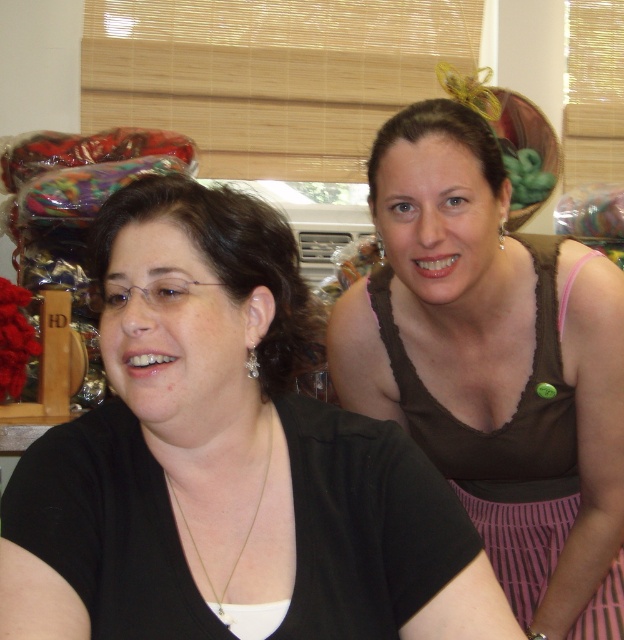
Question: Which point is farther from the camera taking this photo?

Choices:
 (A) [285, 604]
 (B) [295, 406]
 (C) [547, 276]

Answer: (C)

Question: Is matte black shirt at upper right smaller than pink striped fabric dress at upper right?

Choices:
 (A) no
 (B) yes

Answer: (B)

Question: Based on their relative distances, which object is farther from the gold chain necklace at center?

Choices:
 (A) pink striped fabric dress at upper right
 (B) matte black shirt at upper right

Answer: (A)

Question: Can you confirm if matte black shirt at upper right is thinner than pink striped fabric dress at upper right?

Choices:
 (A) yes
 (B) no

Answer: (B)

Question: Which object is the closest to the matte black shirt at upper right?

Choices:
 (A) pink striped fabric dress at upper right
 (B) gold chain necklace at center

Answer: (B)

Question: Can you confirm if matte black shirt at upper right is thinner than gold chain necklace at center?

Choices:
 (A) yes
 (B) no

Answer: (B)